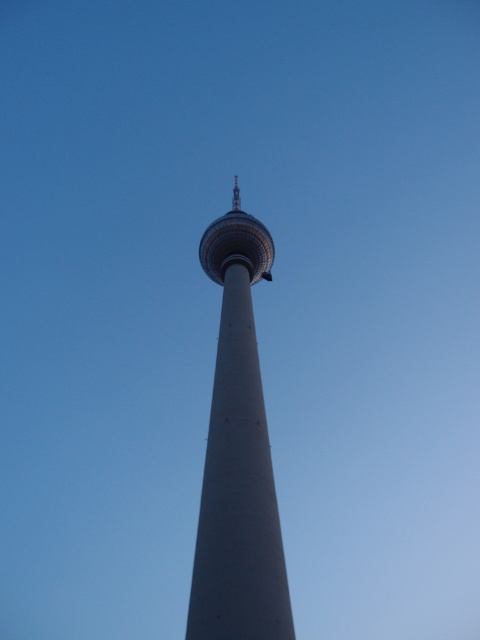
Is smooth concrete tower at center thinner than sleek metallic tower at center?

In fact, smooth concrete tower at center might be wider than sleek metallic tower at center.

Is smooth concrete tower at center smaller than sleek metallic tower at center?

No.

Between point (259, 500) and point (264, 248), which one is positioned behind?

The point (264, 248) is behind.

Locate an element on the screen. smooth concrete tower at center is located at coordinates (238, 458).